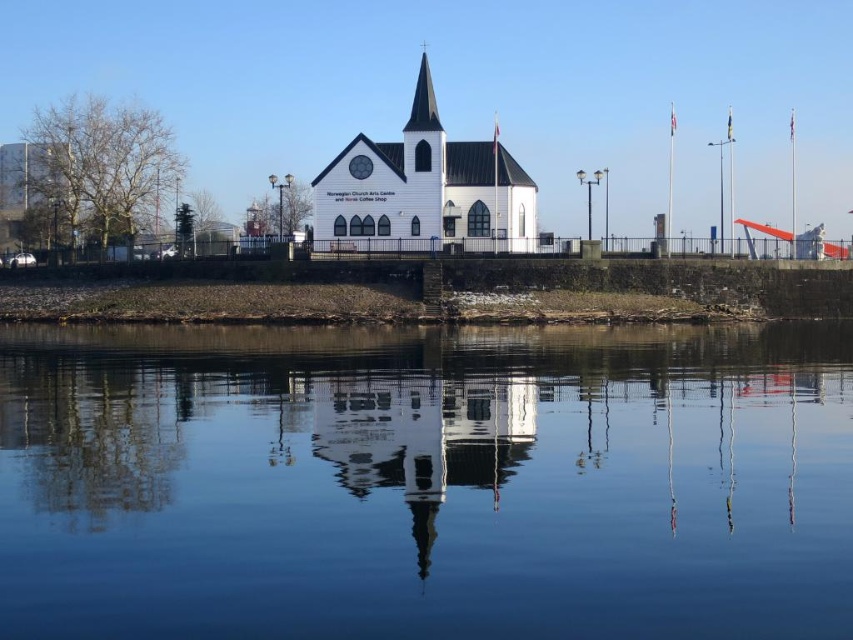
Question: Which object is positioned farthest from the transparent glass water at center?

Choices:
 (A) black glass spire at center
 (B) white wooden church at center

Answer: (A)

Question: Which object is farther from the camera taking this photo?

Choices:
 (A) transparent glass water at center
 (B) white wooden church at center
 (C) black glass spire at center

Answer: (C)

Question: Does transparent glass water at center appear on the right side of white wooden church at center?

Choices:
 (A) no
 (B) yes

Answer: (A)

Question: Is transparent glass water at center above black glass spire at center?

Choices:
 (A) yes
 (B) no

Answer: (B)

Question: Which object appears farthest from the camera in this image?

Choices:
 (A) black glass spire at center
 (B) white wooden church at center
 (C) transparent glass water at center

Answer: (A)

Question: Is transparent glass water at center positioned at the back of white wooden church at center?

Choices:
 (A) yes
 (B) no

Answer: (B)